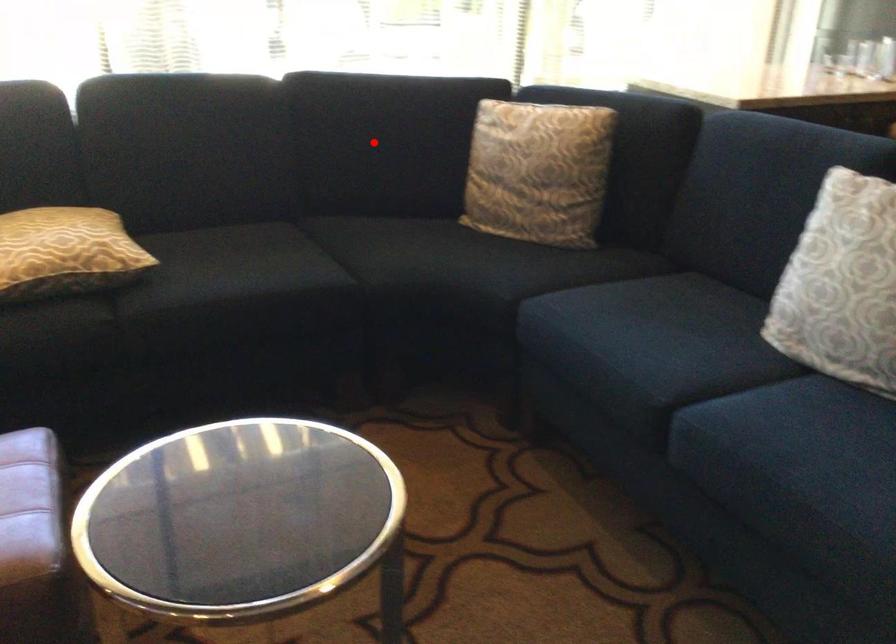
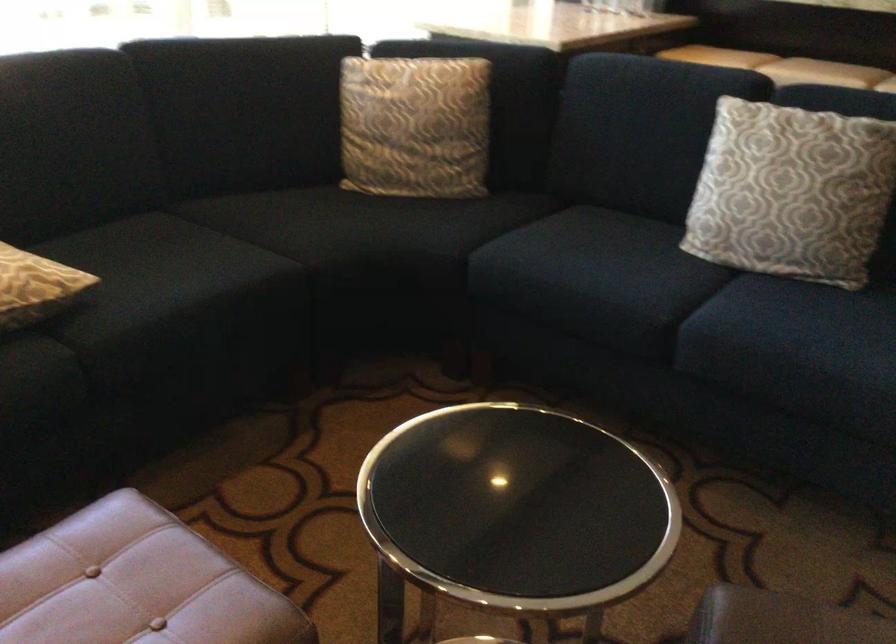
In the second image, find the point that corresponds to the highlighted location in the first image.

(238, 111)